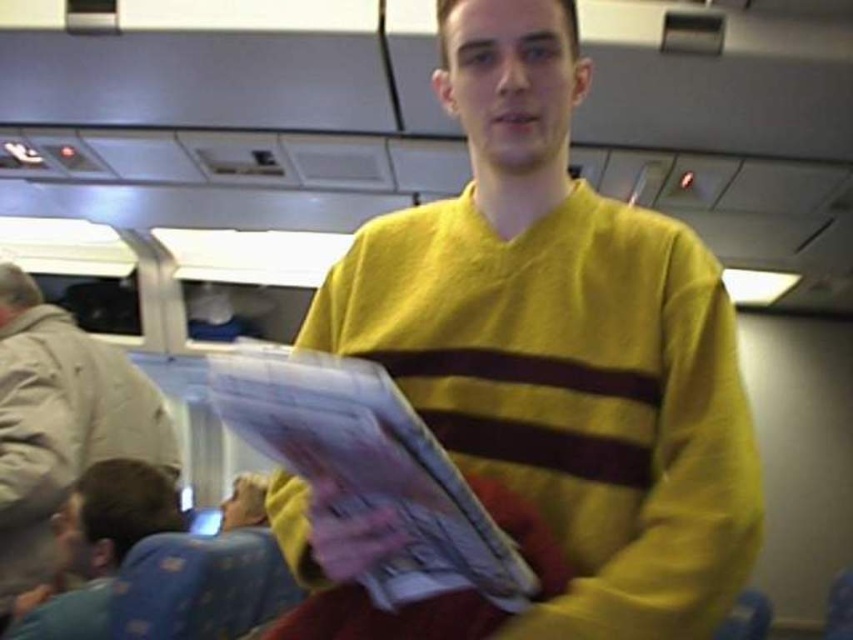
You are standing in the train and want to locate the yellow cotton sweater at center. According to the coordinates provided, where should you look?

You should look at point (561, 344) to find the yellow cotton sweater at center.

You are a photographer trying to capture the yellow cotton sweater at center in a train setting. The camera you are using has a fixed focus point at coordinates (561, 344). Will this focus point align with the sweater?

Yes, the point at coordinates (561, 344) corresponds to the yellow cotton sweater at center, so the focus point will align with the sweater.

You are a photographer trying to capture a candid shot of the person in the yellow sweater. You notice two points in the image at coordinates point (575,204) and point (146,424). Which point is closer to your camera lens?

Point (575,204) is closer to the camera than point (146,424).